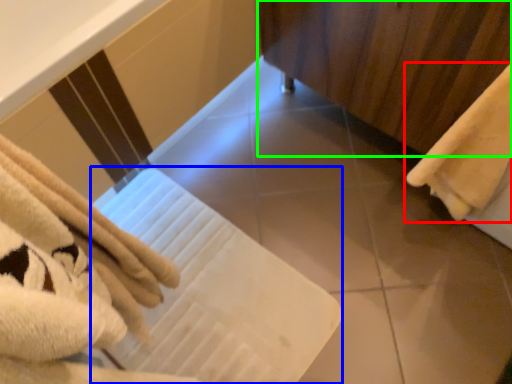
Question: Which object is the farthest from towel (highlighted by a red box)? Choose among these: bath towel (highlighted by a blue box) or curtain (highlighted by a green box).

Choices:
 (A) bath towel
 (B) curtain

Answer: (A)